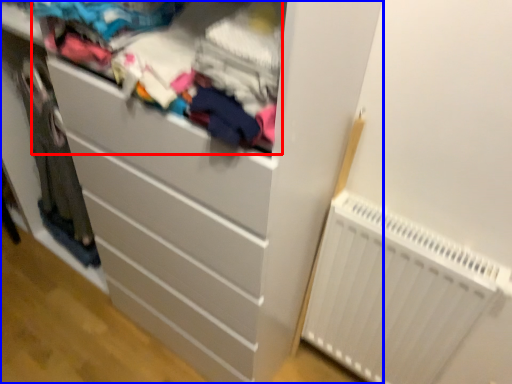
Question: Which point is further to the camera, clothing (highlighted by a red box) or chest of drawers (highlighted by a blue box)?

Choices:
 (A) clothing
 (B) chest of drawers

Answer: (B)